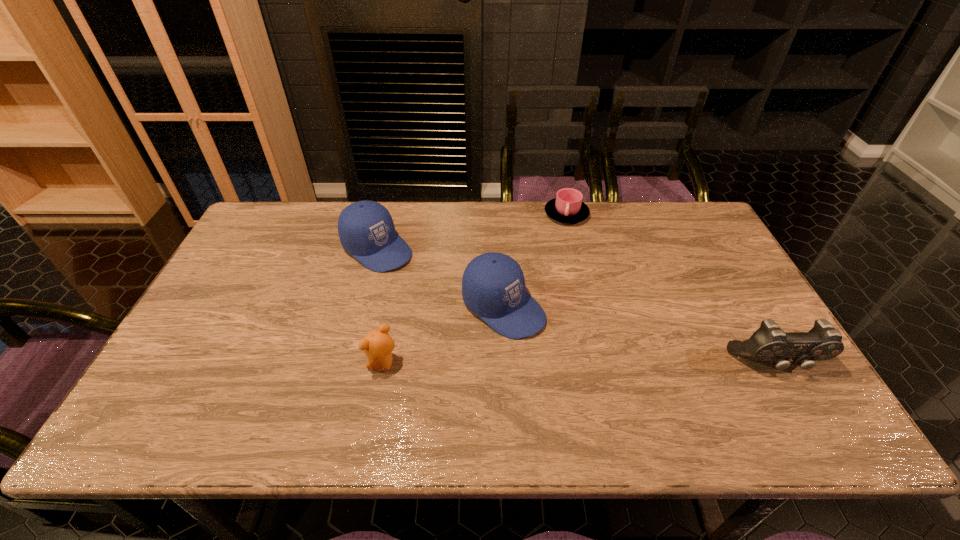
The height and width of the screenshot is (540, 960). Identify the location of teddy bear. (377, 344).

Find the location of `control`. control is located at coordinates (769, 343).

You are a GUI agent. You are given a task and a screenshot of the screen. Output one action in this format:
    pyautogui.click(x=<x>, y=<y>)
    Task: Click on the second object from right to left
    Image resolution: width=960 pixels, height=540 pixels.
    Given the screenshot: What is the action you would take?
    pyautogui.click(x=567, y=207)

I want to click on cup, so click(567, 207).

The height and width of the screenshot is (540, 960). What are the coordinates of `the right cap` in the screenshot? It's located at (493, 286).

The width and height of the screenshot is (960, 540). I want to click on the nearer cap, so click(x=493, y=286).

Identify the location of the farther cap. This screenshot has width=960, height=540. (366, 229).

Locate an element on the screen. The height and width of the screenshot is (540, 960). vacant area situated 0.180m on the face of the teddy bear is located at coordinates (295, 364).

You are a GUI agent. You are given a task and a screenshot of the screen. Output one action in this format:
    pyautogui.click(x=<x>, y=<y>)
    Task: Click on the free space located 0.110m on the face of the teddy bear
    The height and width of the screenshot is (540, 960).
    Given the screenshot: What is the action you would take?
    pyautogui.click(x=323, y=364)

At what (x,y) coordinates should I click in order to perform the action: click on vacant space located 0.300m on the face of the teddy bear. Please return your answer as a coordinate pair (x, y). The image size is (960, 540). Looking at the image, I should click on (246, 364).